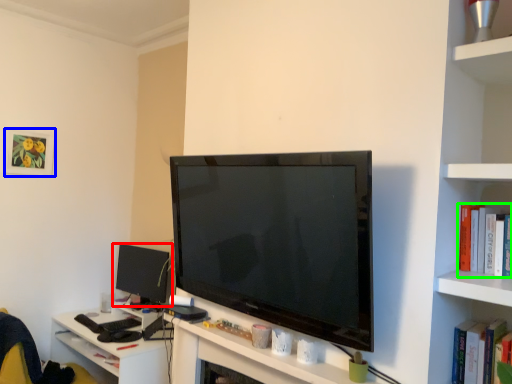
Question: Which is nearer to the computer monitor (highlighted by a red box)? picture frame (highlighted by a blue box) or book (highlighted by a green box).

Choices:
 (A) picture frame
 (B) book

Answer: (A)